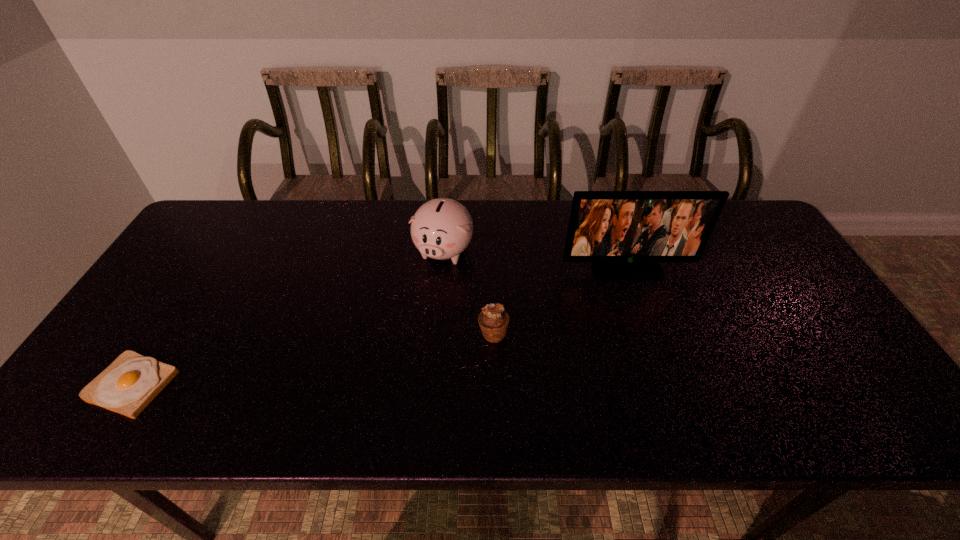
Image resolution: width=960 pixels, height=540 pixels. I want to click on free location located 0.050m on the right of the second shortest object, so click(528, 334).

Image resolution: width=960 pixels, height=540 pixels. Identify the location of free region located on the back of the shortest object. (164, 335).

This screenshot has height=540, width=960. Find the location of `object at the far edge`. object at the far edge is located at coordinates (442, 228).

Locate an element on the screen. The height and width of the screenshot is (540, 960). object present at the near edge is located at coordinates (127, 386).

Find the location of a particular element. The width and height of the screenshot is (960, 540). object that is at the left edge is located at coordinates (127, 386).

This screenshot has width=960, height=540. Identify the location of object present at the near left corner. (127, 386).

In the image, there is a desktop. At what (x,y) coordinates should I click in order to perform the action: click on free space at the far edge. Please return your answer as a coordinate pair (x, y). The height and width of the screenshot is (540, 960). Looking at the image, I should click on (381, 222).

Where is `vacant area at the near edge`? vacant area at the near edge is located at coordinates (804, 416).

Locate an element on the screen. This screenshot has height=540, width=960. blank space at the left edge of the desktop is located at coordinates (206, 252).

You are a GUI agent. You are given a task and a screenshot of the screen. Output one action in this format:
    pyautogui.click(x=<x>, y=<y>)
    Task: Click on the vacant region at the far left corner
    This screenshot has height=540, width=960.
    Given the screenshot: What is the action you would take?
    pyautogui.click(x=225, y=204)